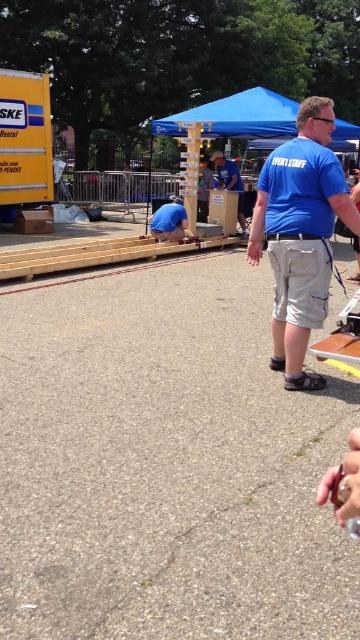
Question: Does wooden at center have a lesser width compared to matte blue shirt at center?

Choices:
 (A) no
 (B) yes

Answer: (A)

Question: Which of the following is the farthest from the observer?

Choices:
 (A) wooden at center
 (B) blue cotton shirt at center
 (C) matte blue shirt at center
 (D) blue fabric at center

Answer: (C)

Question: Among these points, which one is farthest from the camera?

Choices:
 (A) (304, 154)
 (B) (131, 257)
 (C) (177, 221)
 (D) (240, 192)

Answer: (D)

Question: Is blue cotton shirt at center positioned before blue fabric at center?

Choices:
 (A) no
 (B) yes

Answer: (B)

Question: Which object is the closest to the wooden at center?

Choices:
 (A) blue cotton shirt at center
 (B) matte blue shirt at center
 (C) blue fabric at center

Answer: (C)

Question: Does blue cotton shirt at center appear on the left side of wooden at center?

Choices:
 (A) yes
 (B) no

Answer: (B)